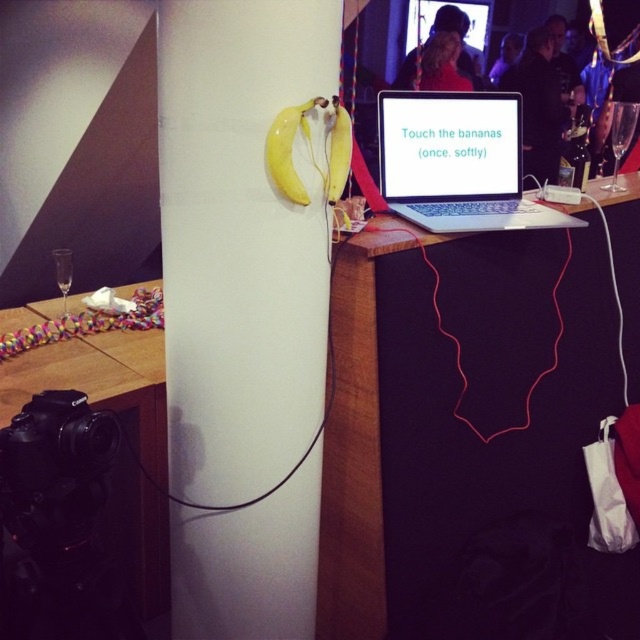
Question: Is wooden table at center positioned at the back of white glossy pillar at center?

Choices:
 (A) no
 (B) yes

Answer: (B)

Question: In this image, where is wooden table at center located relative to satin silver laptop at center?

Choices:
 (A) right
 (B) left

Answer: (A)

Question: Which of the following is the closest to the observer?

Choices:
 (A) (522, 262)
 (B) (422, 157)

Answer: (A)

Question: Which object appears farthest from the camera in this image?

Choices:
 (A) white glossy pillar at center
 (B) satin silver laptop at center
 (C) wooden table at center

Answer: (B)

Question: Which object is positioned closest to the satin silver laptop at center?

Choices:
 (A) white glossy pillar at center
 (B) wooden table at center

Answer: (B)

Question: Does wooden table at center have a smaller size compared to satin silver laptop at center?

Choices:
 (A) yes
 (B) no

Answer: (B)